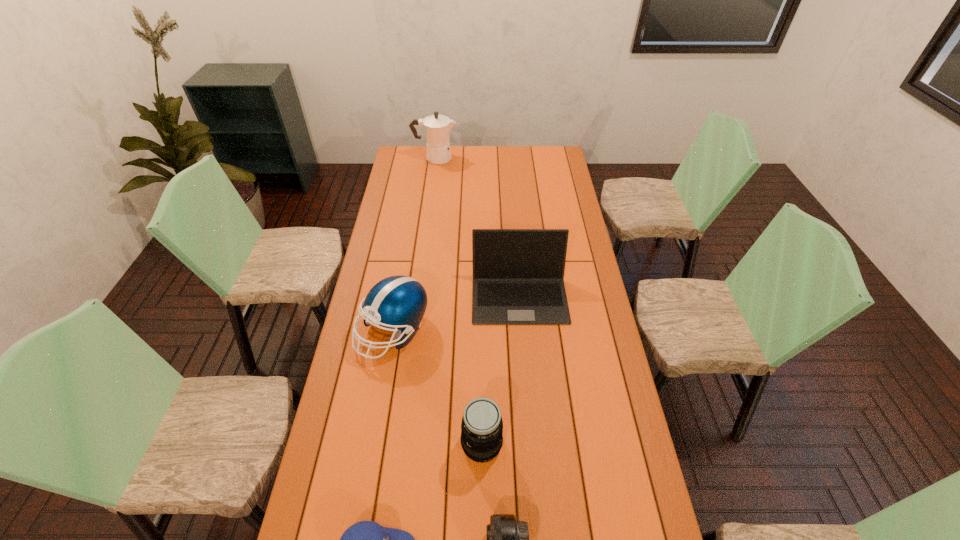
This screenshot has height=540, width=960. I want to click on coffeepot, so click(437, 128).

This screenshot has width=960, height=540. Find the location of `the farthest object`. the farthest object is located at coordinates (437, 128).

Identify the location of laptop. This screenshot has width=960, height=540. (518, 274).

You are a GUI agent. You are given a task and a screenshot of the screen. Output one action in this format:
    pyautogui.click(x=<x>, y=<y>)
    Task: Click on the football helmet
    
    Given the screenshot: What is the action you would take?
    pyautogui.click(x=399, y=302)

I want to click on the third shortest object, so click(481, 438).

This screenshot has height=540, width=960. Find the location of `the taller telephoto lens`. the taller telephoto lens is located at coordinates (481, 438).

The height and width of the screenshot is (540, 960). What are the coordinates of `vacant space situated at the spout of the coffeepot` in the screenshot? It's located at (483, 157).

Find the location of a particular element. vacant space situated on the screen of the laptop is located at coordinates (525, 370).

Find the location of a particular element. free spot located 0.120m at the front of the football helmet with the faceguard is located at coordinates (382, 396).

What are the coordinates of `free location located 0.270m on the back of the fourth farthest object` in the screenshot? It's located at (482, 350).